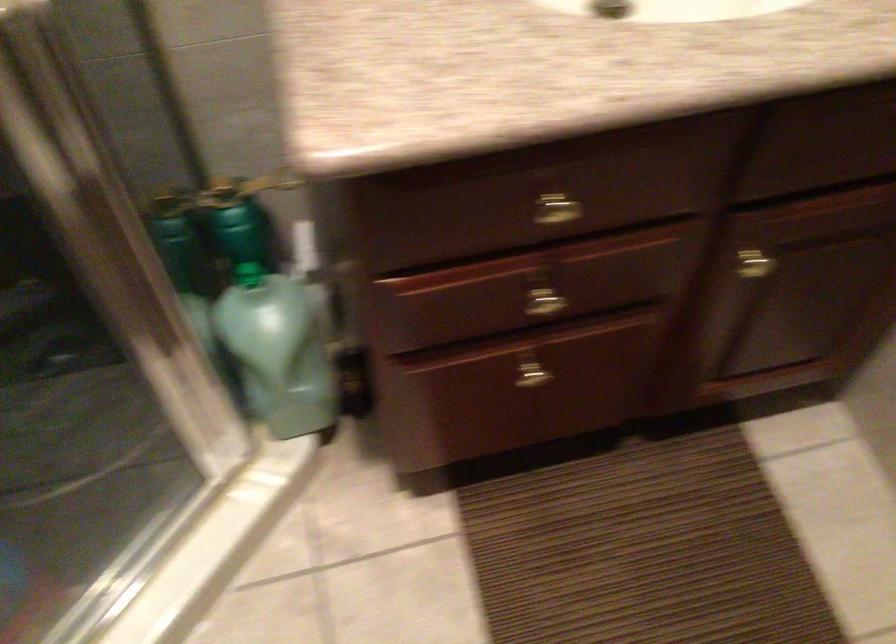
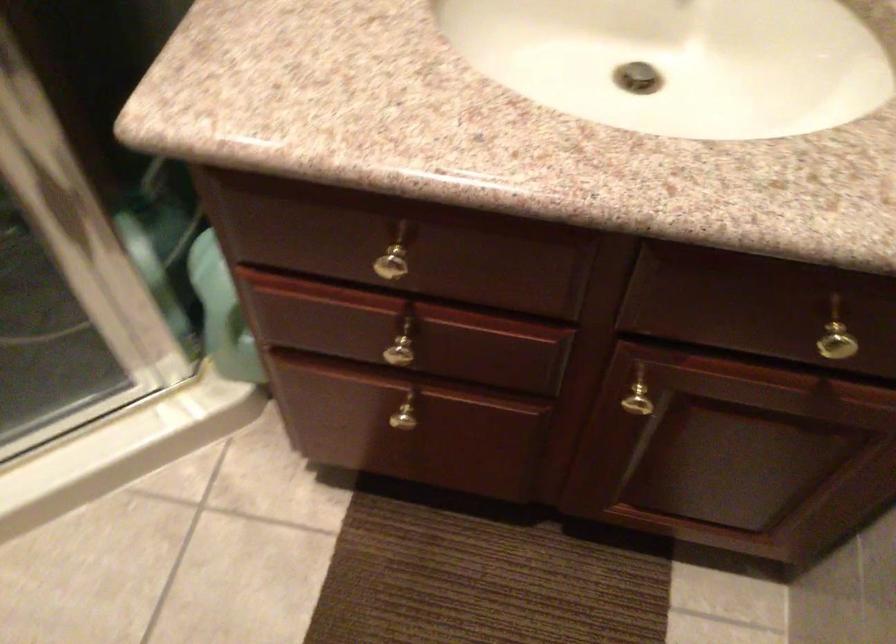
Question: The first image is from the beginning of the video and the second image is from the end. How did the camera likely rotate when shooting the video?

Choices:
 (A) Left
 (B) Right
 (C) Up
 (D) Down

Answer: (A)